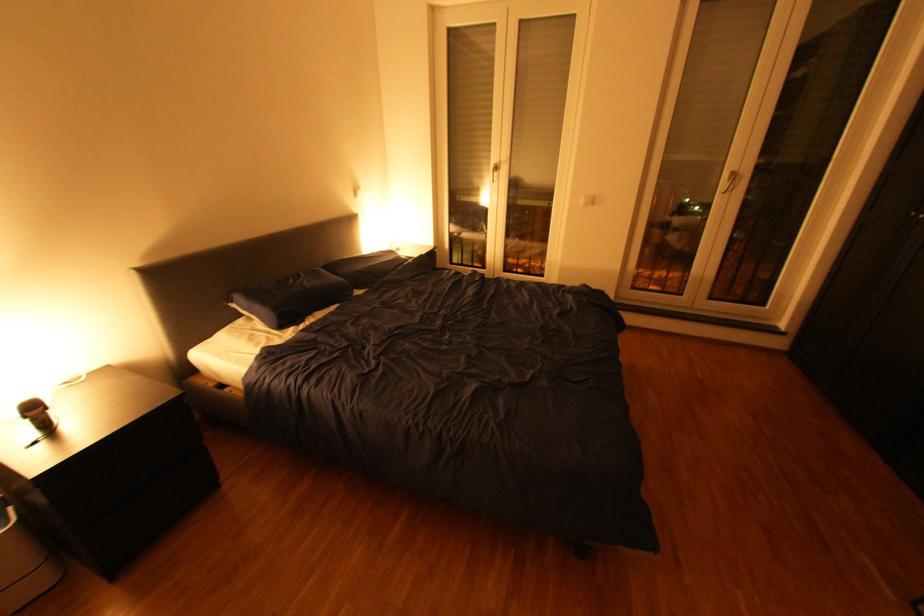
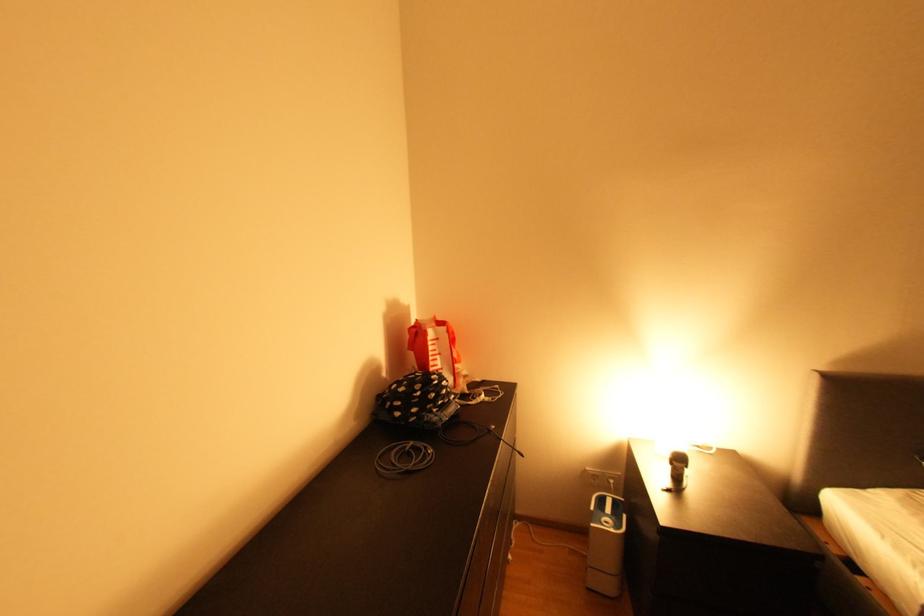
Question: The first image is from the beginning of the video and the second image is from the end. How did the camera likely rotate when shooting the video?

Choices:
 (A) Left
 (B) Right
 (C) Up
 (D) Down

Answer: (A)